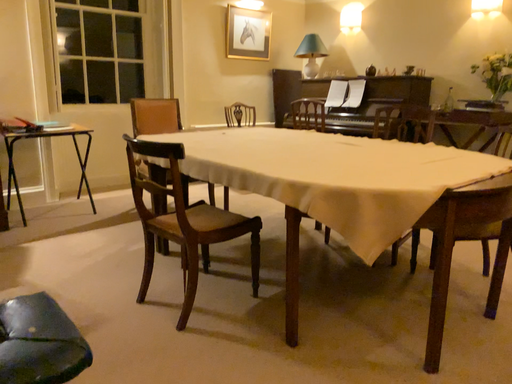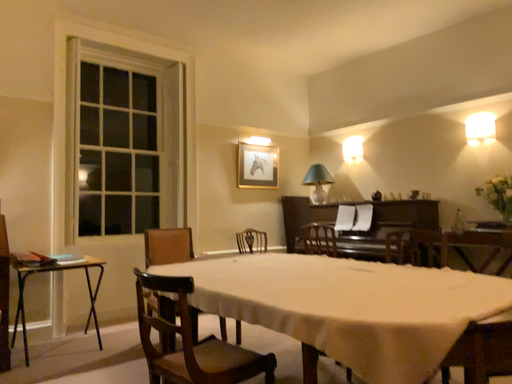
Question: How did the camera likely rotate when shooting the video?

Choices:
 (A) rotated upward
 (B) rotated downward

Answer: (A)